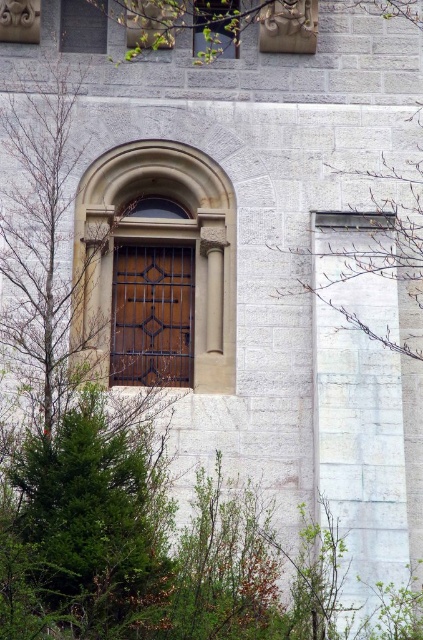
Question: Is matte glass window at upper center wider than matte brown wooden door at upper center?

Choices:
 (A) yes
 (B) no

Answer: (B)

Question: Considering the real-world distances, which object is closest to the matte brown wooden door at upper center?

Choices:
 (A) green leafy tree at center
 (B) matte wood window at upper center
 (C) matte glass window at upper center

Answer: (B)

Question: Which object is closer to the camera taking this photo?

Choices:
 (A) matte brown wooden door at upper center
 (B) matte glass window at upper center
 (C) green leafy tree at center

Answer: (C)

Question: Can you confirm if green leafy tree at center is positioned to the left of matte brown wooden door at upper center?

Choices:
 (A) no
 (B) yes

Answer: (A)

Question: Estimate the real-world distances between objects in this image. Which object is farther from the matte brown wooden door at upper center?

Choices:
 (A) matte wood window at upper center
 (B) green leafy tree at center
 (C) matte glass window at upper center

Answer: (B)

Question: Can you confirm if green leafy tree at center is thinner than matte glass window at upper center?

Choices:
 (A) no
 (B) yes

Answer: (A)